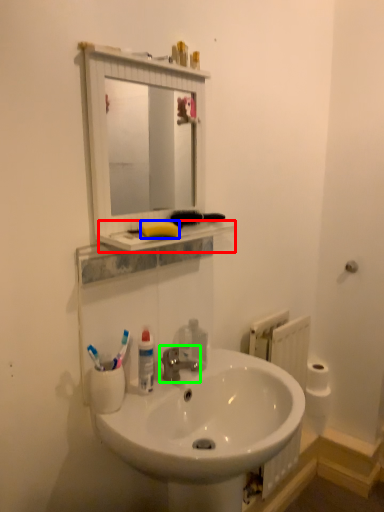
Question: Which object is the closest to the counter top (highlighted by a red box)? Choose among these: soap (highlighted by a blue box) or tap (highlighted by a green box).

Choices:
 (A) soap
 (B) tap

Answer: (A)